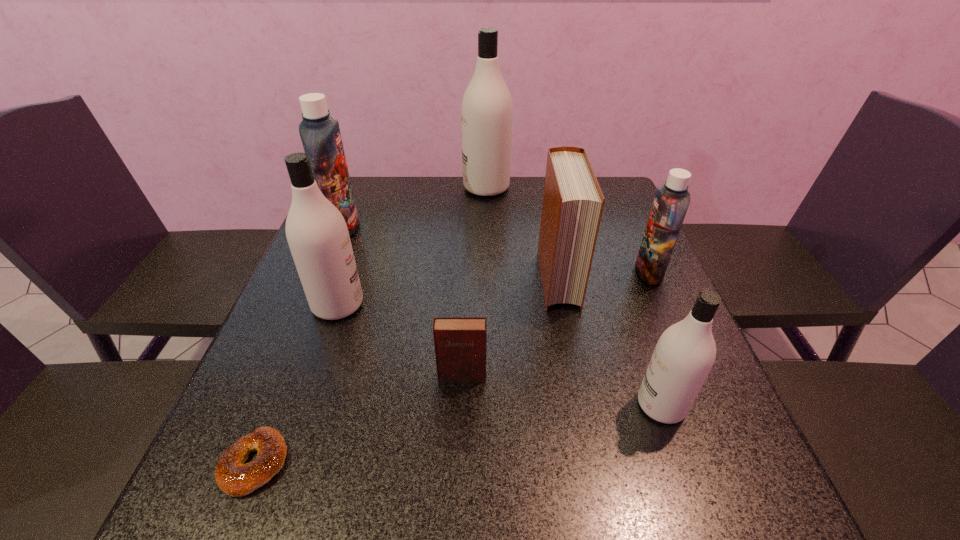
This screenshot has width=960, height=540. I want to click on the second shampoo from right to left, so click(685, 352).

Identify the location of the second shortest object. This screenshot has width=960, height=540. (460, 342).

The width and height of the screenshot is (960, 540). Identify the location of reddish-brown diary. (460, 342).

Locate an element on the screen. The height and width of the screenshot is (540, 960). brown bagel is located at coordinates (233, 477).

You are a GUI agent. You are given a task and a screenshot of the screen. Output one action in this format:
    pyautogui.click(x=<x>, y=<y>)
    Task: Click on the nearest object
    This screenshot has width=960, height=540.
    Given the screenshot: What is the action you would take?
    pyautogui.click(x=233, y=477)

The width and height of the screenshot is (960, 540). I want to click on free space located 0.100m on the front-facing side of the tallest object, so click(x=431, y=187).

Identify the location of free space located on the front-facing side of the tallest object. (428, 187).

The width and height of the screenshot is (960, 540). I want to click on vacant space located on the front-facing side of the tallest object, so click(x=343, y=187).

Where is `vacant space located on the front label of the seventh nearest object`? The height and width of the screenshot is (540, 960). vacant space located on the front label of the seventh nearest object is located at coordinates (395, 228).

What are the coordinates of `vacant space located on the front-facing side of the second biggest white shampoo` in the screenshot? It's located at (435, 305).